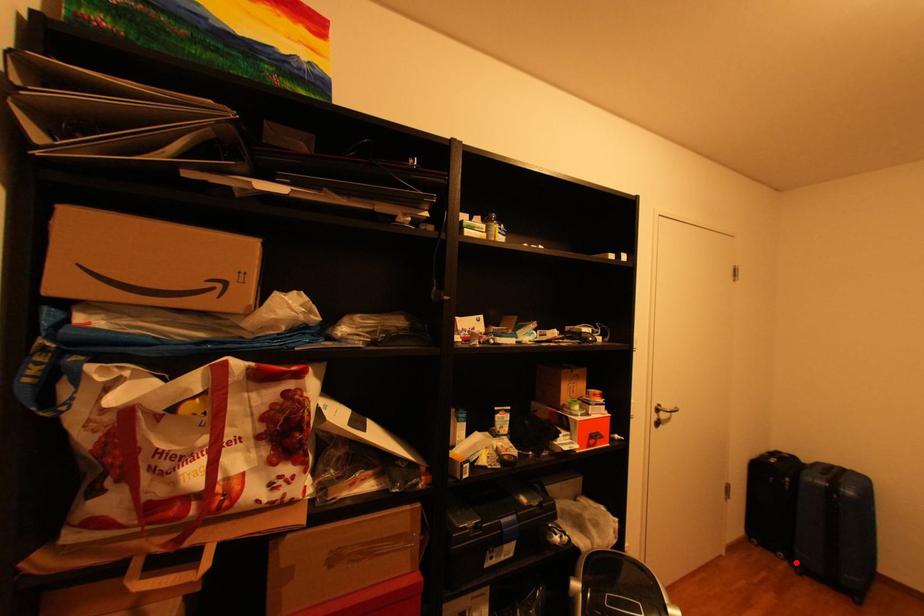
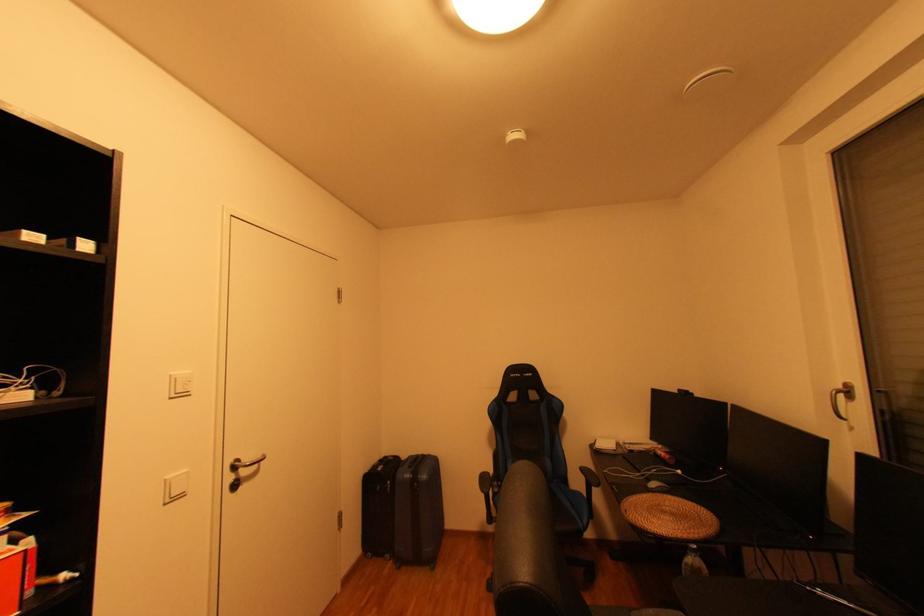
The point at the highlighted location is marked in the first image. Where is the corresponding point in the second image?

(400, 562)